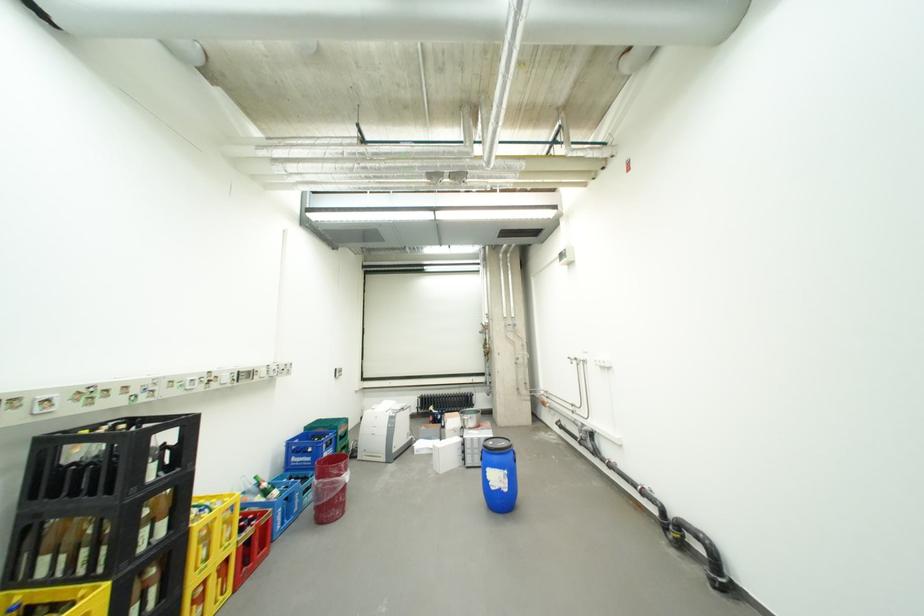
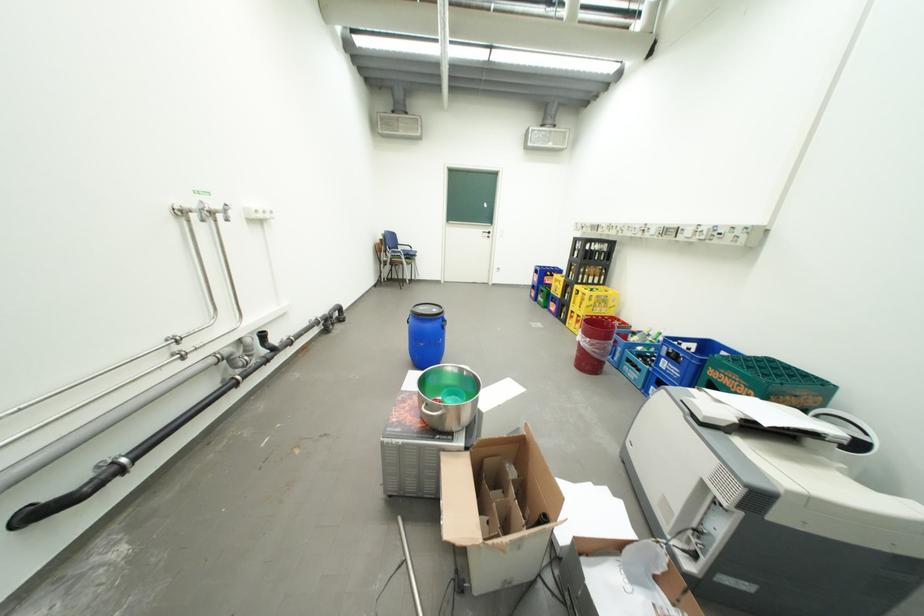
Find the pixel in the second image that matches [334,455] in the first image.

(674, 361)